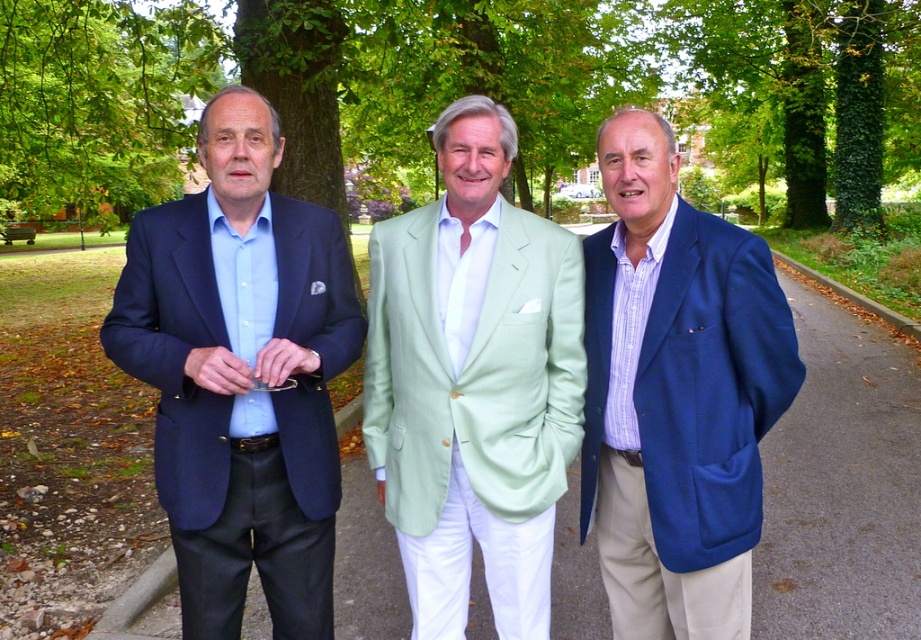
You are a photographer planning to take a group photo of the three men in the park. You want to ensure that both the green leafy tree at upper center and the green leafy tree at left are visible in the background. Which tree will appear smaller in the photo?

The green leafy tree at upper center will appear smaller in the photo because it is not as tall as the green leafy tree at left, making it visually shorter in the background.

What is the color of the suit worn by the man located at the coordinates point (241,376)?

The man at point (241,376) is wearing a matte blue suit.